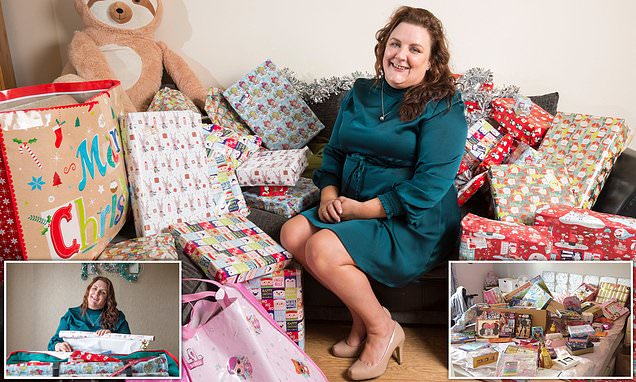
Where is `gift bag`? This screenshot has width=636, height=382. gift bag is located at coordinates (72, 179).